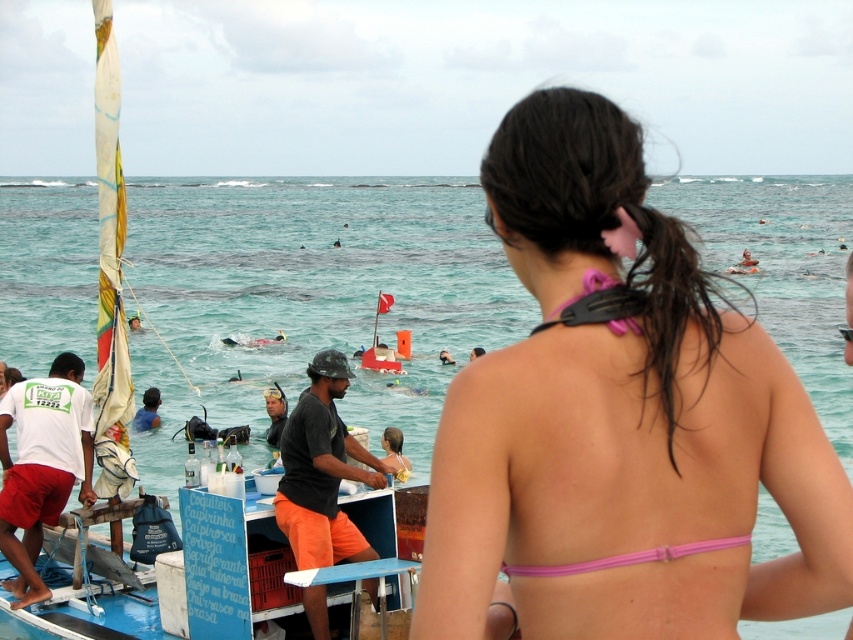
Question: Can you confirm if pink fabric bikini top at upper right is wider than black matte helmet at center?

Choices:
 (A) no
 (B) yes

Answer: (B)

Question: Which point is closer to the camera?

Choices:
 (A) pink fabric bikini at center
 (B) pink fabric bikini at back
 (C) pink fabric bikini top at upper right
 (D) clear blue water at center

Answer: (C)

Question: Based on their relative distances, which object is farther from the black matte helmet at center?

Choices:
 (A) clear blue water at center
 (B) pink fabric bikini at back
 (C) pink fabric bikini at center

Answer: (A)

Question: Considering the relative positions of pink fabric bikini top at upper right and pink fabric bikini at back in the image provided, where is pink fabric bikini top at upper right located with respect to pink fabric bikini at back?

Choices:
 (A) left
 (B) right

Answer: (A)

Question: Is clear blue water at center behind black matte helmet at center?

Choices:
 (A) yes
 (B) no

Answer: (B)

Question: Which of the following is the closest to the observer?

Choices:
 (A) pink fabric bikini top at upper right
 (B) pink fabric bikini at back

Answer: (A)